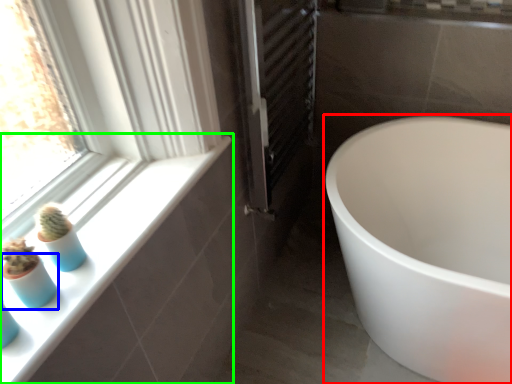
Question: Which is nearer to the bathtub (highlighted by a red box)? glass vase (highlighted by a blue box) or window sill (highlighted by a green box).

Choices:
 (A) glass vase
 (B) window sill

Answer: (B)